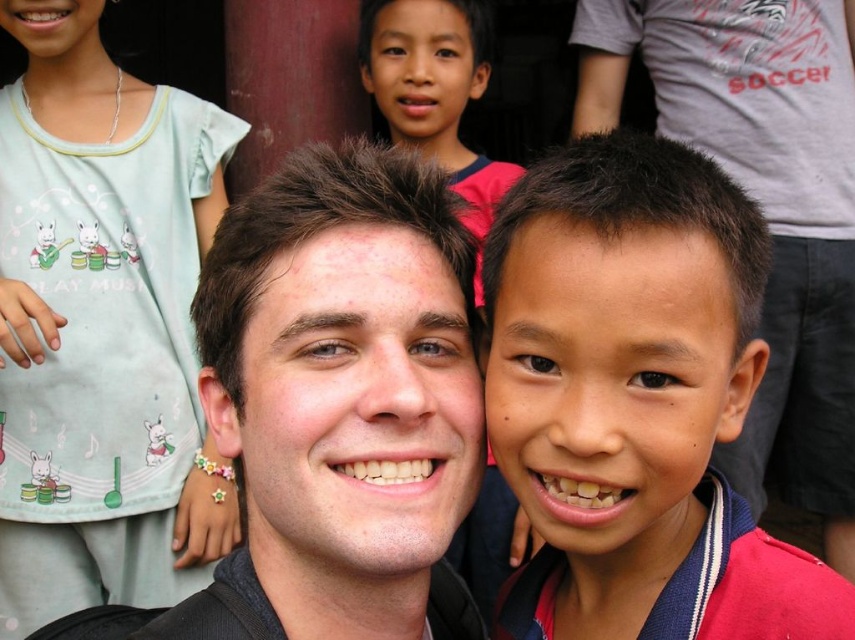
Question: Estimate the real-world distances between objects in this image. Which object is farther from the light blue fabric shirt at upper left?

Choices:
 (A) smooth skin boy at center
 (B) smooth skin face at center
 (C) matte black hair at center

Answer: (A)

Question: Does smooth skin boy at center come behind matte black hair at center?

Choices:
 (A) no
 (B) yes

Answer: (A)

Question: Does matte black hair at center have a larger size compared to light blue fabric shirt at upper left?

Choices:
 (A) no
 (B) yes

Answer: (A)

Question: Which object is closer to the camera taking this photo?

Choices:
 (A) matte black hair at center
 (B) smooth skin face at center
 (C) smooth skin boy at center

Answer: (C)

Question: Which object is positioned farthest from the matte black hair at center?

Choices:
 (A) smooth skin boy at center
 (B) smooth skin face at center
 (C) light blue fabric shirt at upper left

Answer: (C)

Question: Is matte black hair at center in front of light blue fabric shirt at upper left?

Choices:
 (A) no
 (B) yes

Answer: (B)